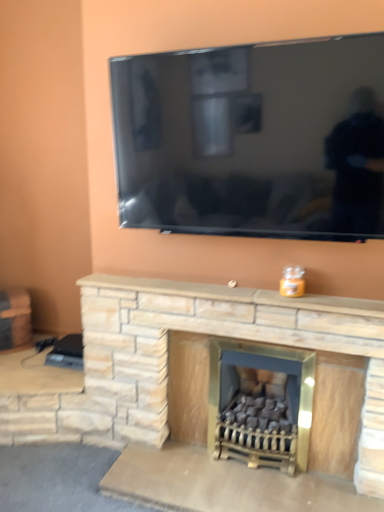
Question: Is natural stone fireplace at center spatially inside matte stone fireplace at center, acting as the second fireplace starting from the left, or outside of it?

Choices:
 (A) outside
 (B) inside

Answer: (A)

Question: Does point (362, 305) appear closer or farther from the camera than point (289, 421)?

Choices:
 (A) closer
 (B) farther

Answer: (A)

Question: Which object is the farthest from the brushed metal side table at left?

Choices:
 (A) natural stone fireplace at center
 (B) natural stone fireplace at center, the 2th fireplace from the right
 (C) matte stone fireplace at center, acting as the second fireplace starting from the left

Answer: (C)

Question: Estimate the real-world distances between objects in this image. Which object is farther from the matte stone fireplace at center, acting as the second fireplace starting from the left?

Choices:
 (A) natural stone fireplace at center, the 2th fireplace from the right
 (B) brushed metal side table at left
 (C) natural stone fireplace at center

Answer: (B)